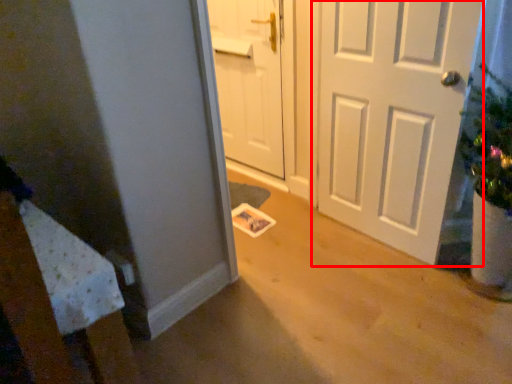
Question: From the image's perspective, where is door (annotated by the red box) located relative to door?

Choices:
 (A) below
 (B) above

Answer: (A)